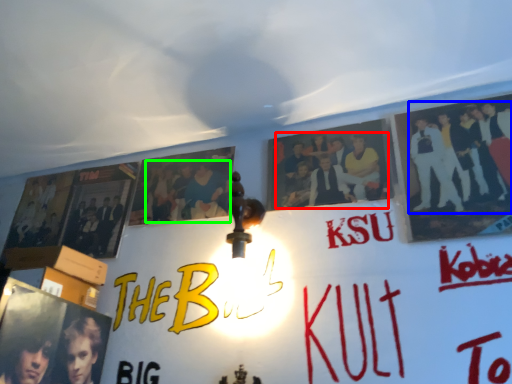
Question: Which object is the closest to the person (highlighted by a red box)? Choose among these: person (highlighted by a blue box) or person (highlighted by a green box).

Choices:
 (A) person
 (B) person

Answer: (A)